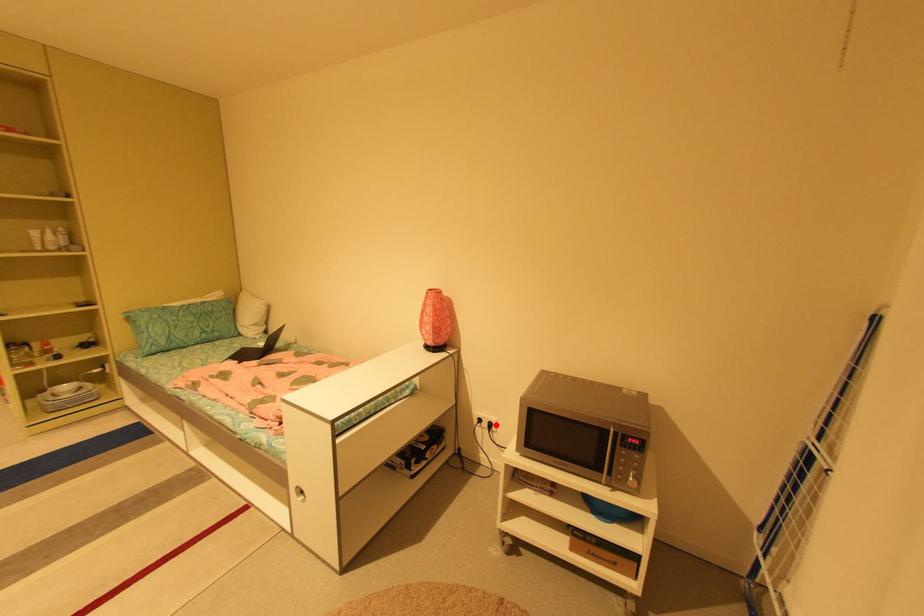
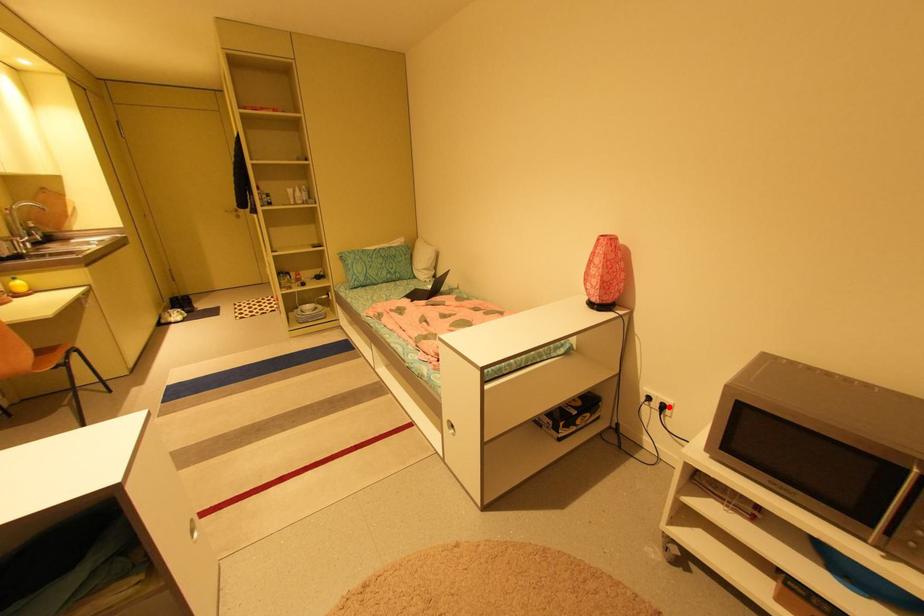
I am providing you with two images of the same scene from different viewpoints. A red point is marked on the first image and another point is marked on the second image. Does the point marked in image1 correspond to the same location as the one in image2?

Yes